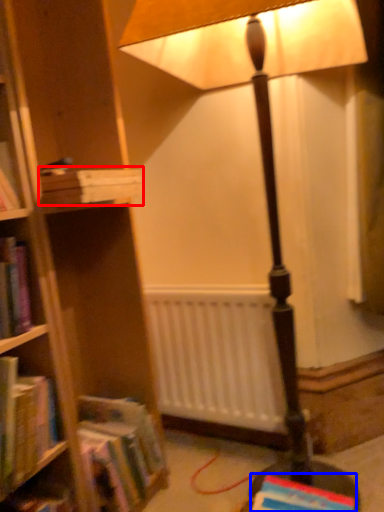
Question: Which object appears farthest to the camera in this image, book (highlighted by a red box) or book (highlighted by a blue box)?

Choices:
 (A) book
 (B) book

Answer: (A)